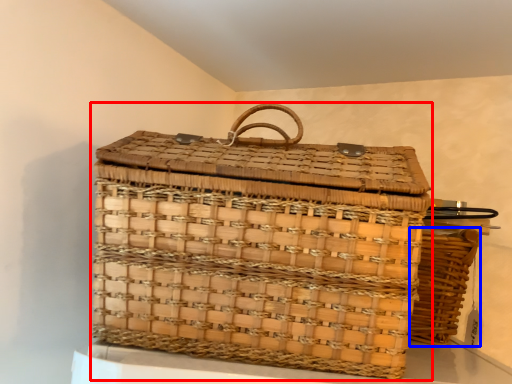
Question: Which point is closer to the camera, picnic basket (highlighted by a red box) or picnic basket (highlighted by a blue box)?

Choices:
 (A) picnic basket
 (B) picnic basket

Answer: (A)